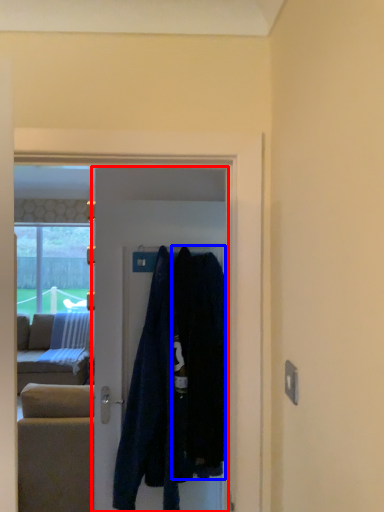
Question: Which point is closer to the camera, door (highlighted by a red box) or clothing (highlighted by a blue box)?

Choices:
 (A) door
 (B) clothing

Answer: (B)